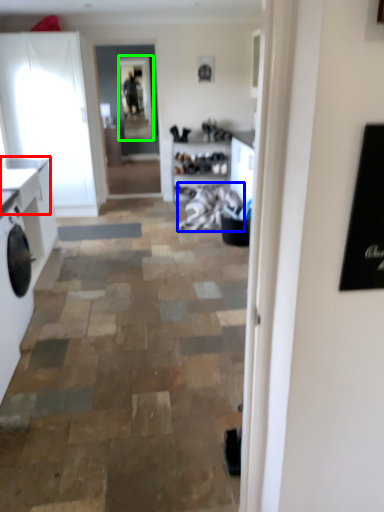
Question: Estimate the real-world distances between objects in this image. Which object is closer to counter top (highlighted by a red box), laundry (highlighted by a blue box) or window screen (highlighted by a green box)?

Choices:
 (A) laundry
 (B) window screen

Answer: (A)